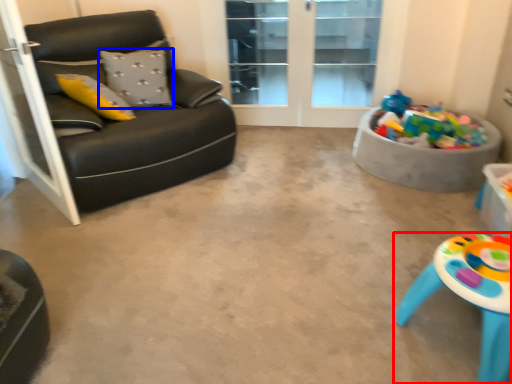
Question: Which point is closer to the camera, table (highlighted by a red box) or pillow (highlighted by a blue box)?

Choices:
 (A) table
 (B) pillow

Answer: (A)